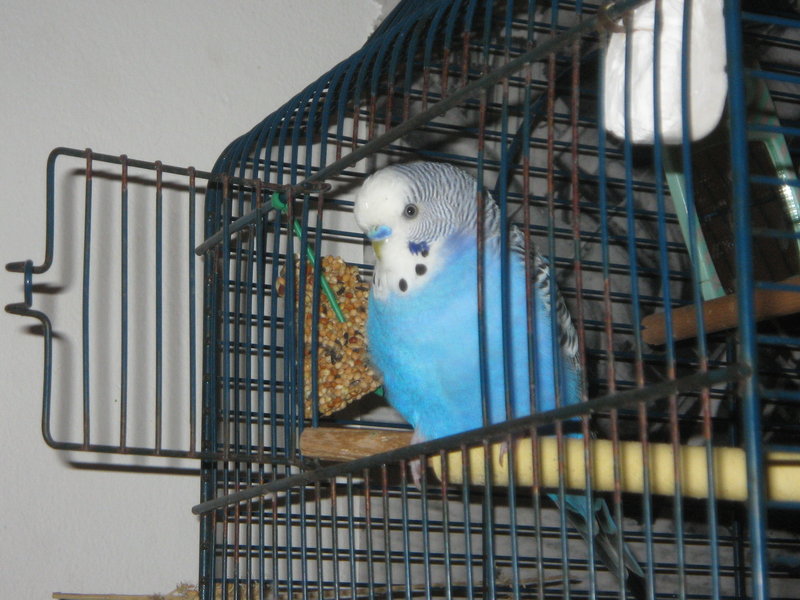
What are the coordinates of `puff` in the screenshot? It's located at (436, 205).